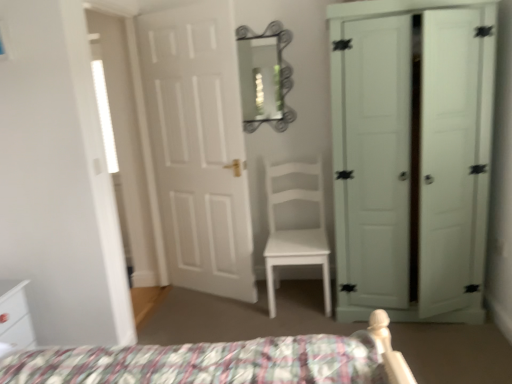
Question: From the image's perspective, is white matte chair at center located beneath white glossy nightstand at lower left?

Choices:
 (A) no
 (B) yes

Answer: (A)

Question: Does white matte chair at center have a larger size compared to white glossy nightstand at lower left?

Choices:
 (A) yes
 (B) no

Answer: (A)

Question: From a real-world perspective, is white matte chair at center physically below white glossy nightstand at lower left?

Choices:
 (A) yes
 (B) no

Answer: (B)

Question: Is white matte chair at center positioned before white glossy nightstand at lower left?

Choices:
 (A) no
 (B) yes

Answer: (A)

Question: Does white matte chair at center have a smaller size compared to white glossy nightstand at lower left?

Choices:
 (A) yes
 (B) no

Answer: (B)

Question: Could you tell me if white matte chair at center is facing white glossy nightstand at lower left?

Choices:
 (A) yes
 (B) no

Answer: (B)

Question: Can you confirm if white glossy nightstand at lower left is shorter than white matte door at center, which is counted as the first door, starting from the left?

Choices:
 (A) no
 (B) yes

Answer: (B)

Question: Is white glossy nightstand at lower left completely or partially outside of white matte door at center, which is counted as the first door, starting from the left?

Choices:
 (A) no
 (B) yes

Answer: (B)

Question: Does white glossy nightstand at lower left have a greater height compared to white matte door at center, which is counted as the first door, starting from the left?

Choices:
 (A) no
 (B) yes

Answer: (A)

Question: Is white glossy nightstand at lower left oriented towards white matte door at center, marked as the 2th door in a right-to-left arrangement?

Choices:
 (A) no
 (B) yes

Answer: (A)

Question: From the image's perspective, is white glossy nightstand at lower left beneath white matte door at center, marked as the 2th door in a right-to-left arrangement?

Choices:
 (A) yes
 (B) no

Answer: (A)

Question: Can you confirm if white glossy nightstand at lower left is smaller than white matte door at center, marked as the 2th door in a right-to-left arrangement?

Choices:
 (A) yes
 (B) no

Answer: (A)

Question: From the image's perspective, does white glossy nightstand at lower left appear lower than metallic silver mirror at upper center?

Choices:
 (A) no
 (B) yes

Answer: (B)